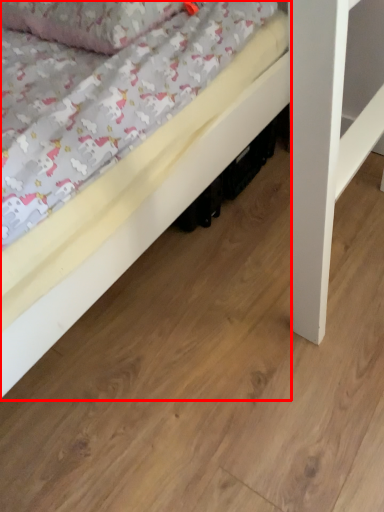
Question: Where is bed (annotated by the red box) located in relation to pillow in the image?

Choices:
 (A) right
 (B) left

Answer: (A)